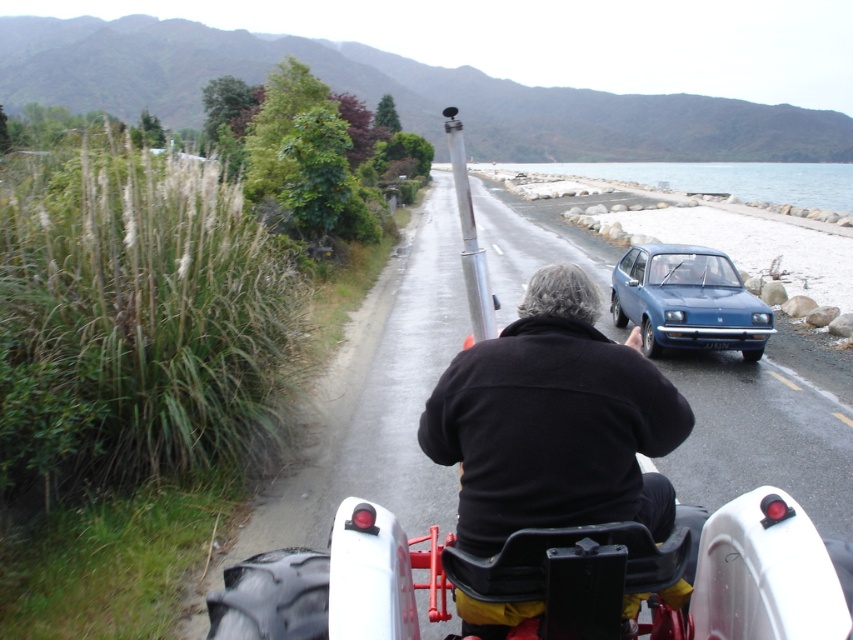
Question: Where is blue matte hatchback at center located in relation to gray/rocky water at upper center in the image?

Choices:
 (A) above
 (B) below

Answer: (B)

Question: Considering the relative positions of black soft jacket at center and gray/rocky water at upper center in the image provided, where is black soft jacket at center located with respect to gray/rocky water at upper center?

Choices:
 (A) left
 (B) right

Answer: (A)

Question: Which of the following is the closest to the observer?

Choices:
 (A) gray/rocky water at upper center
 (B) blue matte hatchback at center

Answer: (B)

Question: Which point is farther from the camera taking this photo?

Choices:
 (A) (631, 394)
 (B) (751, 180)

Answer: (B)

Question: Which point appears farthest from the camera in this image?

Choices:
 (A) (721, 280)
 (B) (614, 438)

Answer: (A)

Question: Is black soft jacket at center in front of blue matte hatchback at center?

Choices:
 (A) yes
 (B) no

Answer: (A)